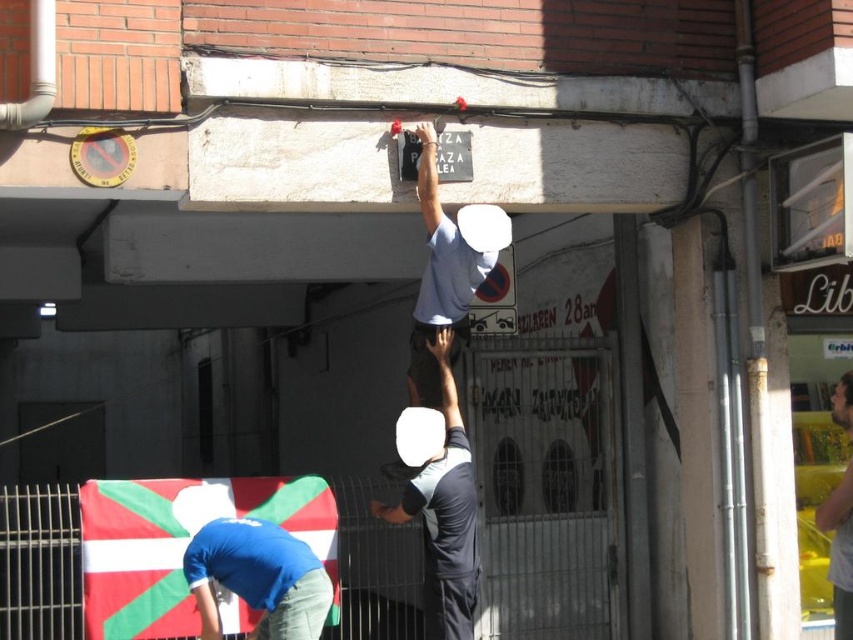
Does green and white fabric flag at lower left come in front of light brown wooden board at upper right?

That is False.

Which of these two, green and white fabric flag at lower left or light brown wooden board at upper right, stands shorter?

With less height is light brown wooden board at upper right.

Which is in front, point (103, 566) or point (842, 499)?

Point (842, 499) is more forward.

At what (x,y) coordinates should I click in order to perform the action: click on green and white fabric flag at lower left. Please return your answer as a coordinate pair (x, y). The image size is (853, 640). Looking at the image, I should click on (181, 544).

Does dark gray fabric shirt at upper center have a greater height compared to light blue fabric shirt at upper center?

Yes.

Which is behind, point (447, 506) or point (442, 273)?

Positioned behind is point (442, 273).

This screenshot has height=640, width=853. Find the location of `dark gray fabric shirt at upper center`. dark gray fabric shirt at upper center is located at coordinates (444, 515).

Does green and white fabric flag at lower left have a greater width compared to dark gray fabric shirt at upper center?

Correct, the width of green and white fabric flag at lower left exceeds that of dark gray fabric shirt at upper center.

Does green and white fabric flag at lower left have a lesser width compared to dark gray fabric shirt at upper center?

No, green and white fabric flag at lower left is not thinner than dark gray fabric shirt at upper center.

Who is more forward, (x=299, y=516) or (x=466, y=490)?

Point (x=466, y=490) is more forward.

At what (x,y) coordinates should I click in order to perform the action: click on green and white fabric flag at lower left. Please return your answer as a coordinate pair (x, y). This screenshot has width=853, height=640. Looking at the image, I should click on (181, 544).